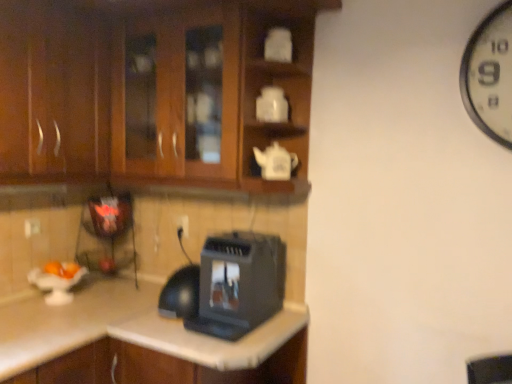
Question: Could white plastic electric outlet at center be considered to be inside black plastic toaster at lower center?

Choices:
 (A) no
 (B) yes

Answer: (A)

Question: Does black plastic toaster at lower center have a lesser width compared to white plastic electric outlet at center?

Choices:
 (A) yes
 (B) no

Answer: (B)

Question: Is black plastic toaster at lower center looking in the opposite direction of white plastic electric outlet at center?

Choices:
 (A) no
 (B) yes

Answer: (A)

Question: From the image's perspective, would you say black plastic toaster at lower center is positioned over white plastic electric outlet at center?

Choices:
 (A) no
 (B) yes

Answer: (A)

Question: Does black plastic toaster at lower center have a larger size compared to white plastic electric outlet at center?

Choices:
 (A) yes
 (B) no

Answer: (A)

Question: Considering the positions of metallic black toaster at lower left and black plastic toaster at lower center in the image, is metallic black toaster at lower left wider or thinner than black plastic toaster at lower center?

Choices:
 (A) wide
 (B) thin

Answer: (B)

Question: In terms of height, does metallic black toaster at lower left look taller or shorter compared to black plastic toaster at lower center?

Choices:
 (A) tall
 (B) short

Answer: (A)

Question: Is metallic black toaster at lower left spatially inside black plastic toaster at lower center, or outside of it?

Choices:
 (A) outside
 (B) inside

Answer: (A)

Question: From the image's perspective, is metallic black toaster at lower left above or below black plastic toaster at lower center?

Choices:
 (A) below
 (B) above

Answer: (B)

Question: Based on their sizes in the image, would you say dark wood cabinet at left, which appears as the second cabinetry when viewed from the right, is bigger or smaller than brown wood cabinets at upper left, the first cabinetry in the right-to-left sequence?

Choices:
 (A) small
 (B) big

Answer: (A)

Question: In terms of width, does dark wood cabinet at left, which appears as the second cabinetry when viewed from the right, look wider or thinner when compared to brown wood cabinets at upper left, positioned as the 2th cabinetry in left-to-right order?

Choices:
 (A) thin
 (B) wide

Answer: (A)

Question: Is point (81, 11) positioned closer to the camera than point (53, 79)?

Choices:
 (A) farther
 (B) closer

Answer: (A)

Question: Is dark wood cabinet at left, which appears as the second cabinetry when viewed from the right, spatially inside brown wood cabinets at upper left, the first cabinetry in the right-to-left sequence, or outside of it?

Choices:
 (A) inside
 (B) outside

Answer: (A)

Question: From a real-world perspective, is brown wood cabinets at upper left, the first cabinetry in the right-to-left sequence, physically located above or below dark wood cabinet at left, the 1th cabinetry positioned from the left?

Choices:
 (A) below
 (B) above

Answer: (B)

Question: Is brown wood cabinets at upper left, the first cabinetry in the right-to-left sequence, taller or shorter than dark wood cabinet at left, which appears as the second cabinetry when viewed from the right?

Choices:
 (A) tall
 (B) short

Answer: (A)